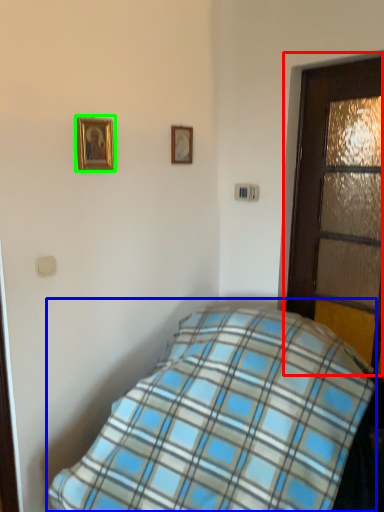
Question: Estimate the real-world distances between objects in this image. Which object is farther from door (highlighted by a red box), bed (highlighted by a blue box) or picture frame (highlighted by a green box)?

Choices:
 (A) bed
 (B) picture frame

Answer: (B)